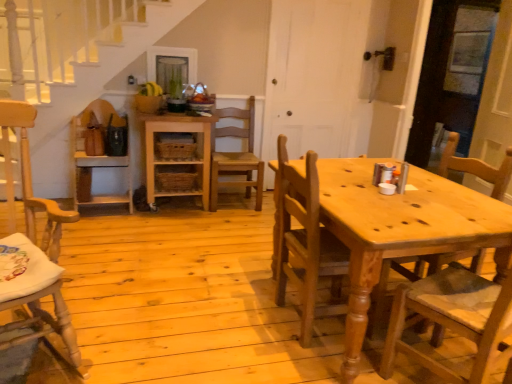
You are a GUI agent. You are given a task and a screenshot of the screen. Output one action in this format:
    pyautogui.click(x=<x>, y=<y>)
    Task: Click on the empty space that is in between natural wood chair at center, which appears as the second chair when viewed from the right, and light brown wood chair at left, which is counted as the fourth chair, starting from the right
    This screenshot has height=384, width=512.
    Given the screenshot: What is the action you would take?
    pyautogui.click(x=179, y=334)